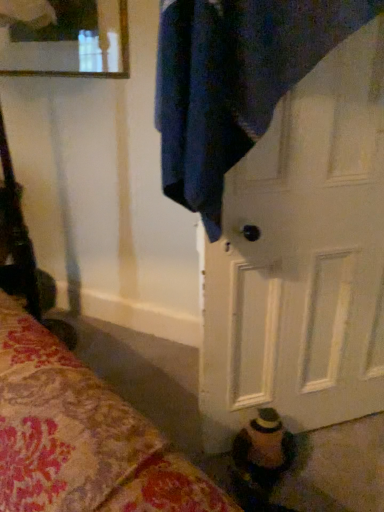
Question: Can you confirm if white matte door at center is wider than clear glass mirror at upper left?

Choices:
 (A) no
 (B) yes

Answer: (B)

Question: Is white matte door at center closer to the viewer compared to clear glass mirror at upper left?

Choices:
 (A) yes
 (B) no

Answer: (A)

Question: Can we say white matte door at center lies outside clear glass mirror at upper left?

Choices:
 (A) no
 (B) yes

Answer: (B)

Question: From a real-world perspective, does white matte door at center stand above clear glass mirror at upper left?

Choices:
 (A) yes
 (B) no

Answer: (B)

Question: Is clear glass mirror at upper left located within white matte door at center?

Choices:
 (A) yes
 (B) no

Answer: (B)

Question: From the image's perspective, would you say white matte door at center is shown under clear glass mirror at upper left?

Choices:
 (A) yes
 (B) no

Answer: (A)

Question: Is clear glass mirror at upper left thinner than white matte door at center?

Choices:
 (A) no
 (B) yes

Answer: (B)

Question: Can you confirm if clear glass mirror at upper left is bigger than white matte door at center?

Choices:
 (A) yes
 (B) no

Answer: (B)

Question: Is clear glass mirror at upper left closer to the viewer compared to white matte door at center?

Choices:
 (A) no
 (B) yes

Answer: (A)

Question: Is clear glass mirror at upper left at the right side of white matte door at center?

Choices:
 (A) yes
 (B) no

Answer: (B)

Question: Is the surface of clear glass mirror at upper left in direct contact with white matte door at center?

Choices:
 (A) yes
 (B) no

Answer: (B)

Question: Considering the relative positions of clear glass mirror at upper left and white matte door at center in the image provided, is clear glass mirror at upper left to the left of white matte door at center from the viewer's perspective?

Choices:
 (A) no
 (B) yes

Answer: (B)

Question: Considering the positions of white matte door at center and clear glass mirror at upper left in the image, is white matte door at center wider or thinner than clear glass mirror at upper left?

Choices:
 (A) wide
 (B) thin

Answer: (A)